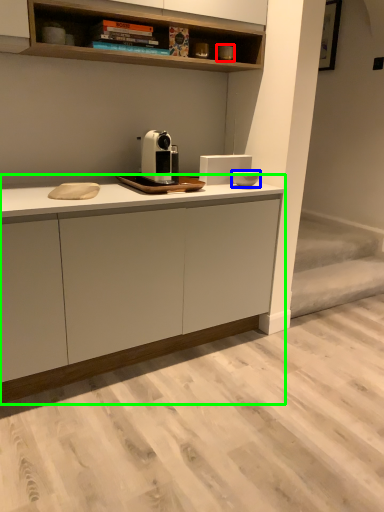
Question: Considering the real-world distances, which object is closest to appliance (highlighted by a red box)? appliance (highlighted by a blue box) or cabinetry (highlighted by a green box).

Choices:
 (A) appliance
 (B) cabinetry

Answer: (A)